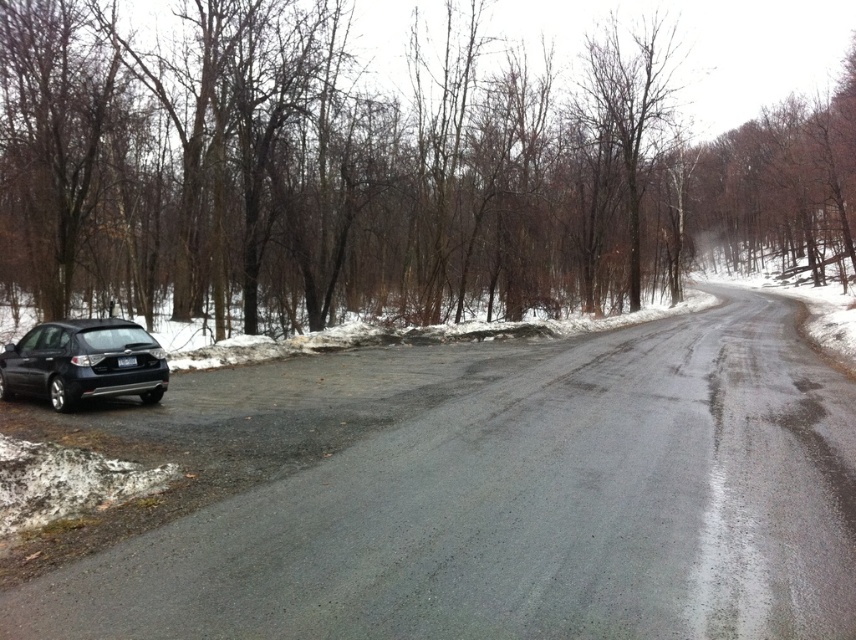
Question: Considering the relative positions of brown matte tree at left and black matte car at left in the image provided, where is brown matte tree at left located with respect to black matte car at left?

Choices:
 (A) above
 (B) below

Answer: (A)

Question: Which of the following is the closest to the observer?

Choices:
 (A) satin black hatchback at lower left
 (B) black matte car at left

Answer: (B)

Question: Is brown matte tree at left below satin black hatchback at lower left?

Choices:
 (A) no
 (B) yes

Answer: (A)

Question: Which is nearer to the brown matte tree at left?

Choices:
 (A) satin black hatchback at lower left
 (B) black matte car at left

Answer: (A)

Question: Is brown matte tree at left above black matte car at left?

Choices:
 (A) no
 (B) yes

Answer: (B)

Question: Which object is positioned farthest from the brown matte tree at left?

Choices:
 (A) black matte car at left
 (B) satin black hatchback at lower left

Answer: (A)